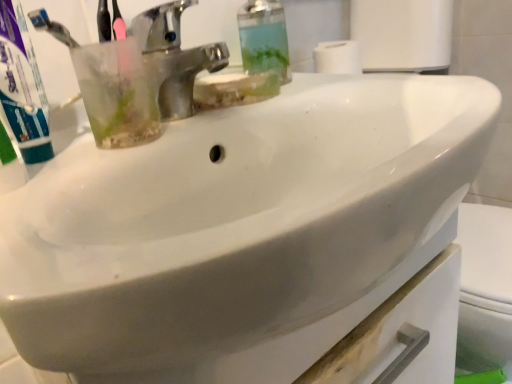
Question: From a real-world perspective, is transparent plastic soap dispenser at upper center physically located above or below polished chrome faucet at upper center?

Choices:
 (A) above
 (B) below

Answer: (A)

Question: Is transparent plastic soap dispenser at upper center to the left or to the right of polished chrome faucet at upper center in the image?

Choices:
 (A) right
 (B) left

Answer: (A)

Question: Based on their relative distances, which object is nearer to the green matte toothpaste at left?

Choices:
 (A) polished chrome faucet at upper center
 (B) transparent plastic soap dispenser at upper center

Answer: (A)

Question: Estimate the real-world distances between objects in this image. Which object is farther from the polished chrome faucet at upper center?

Choices:
 (A) green matte toothpaste at left
 (B) transparent plastic soap dispenser at upper center

Answer: (A)